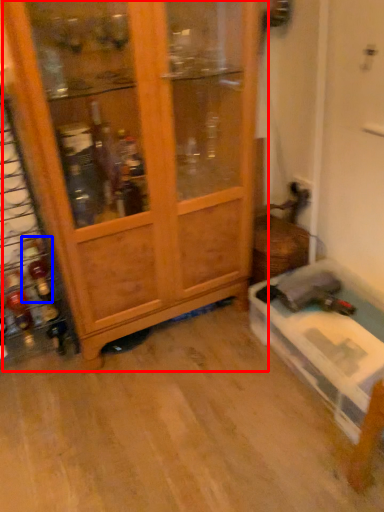
Question: Among these objects, which one is farthest to the camera, cupboard (highlighted by a red box) or bottle (highlighted by a blue box)?

Choices:
 (A) cupboard
 (B) bottle

Answer: (B)